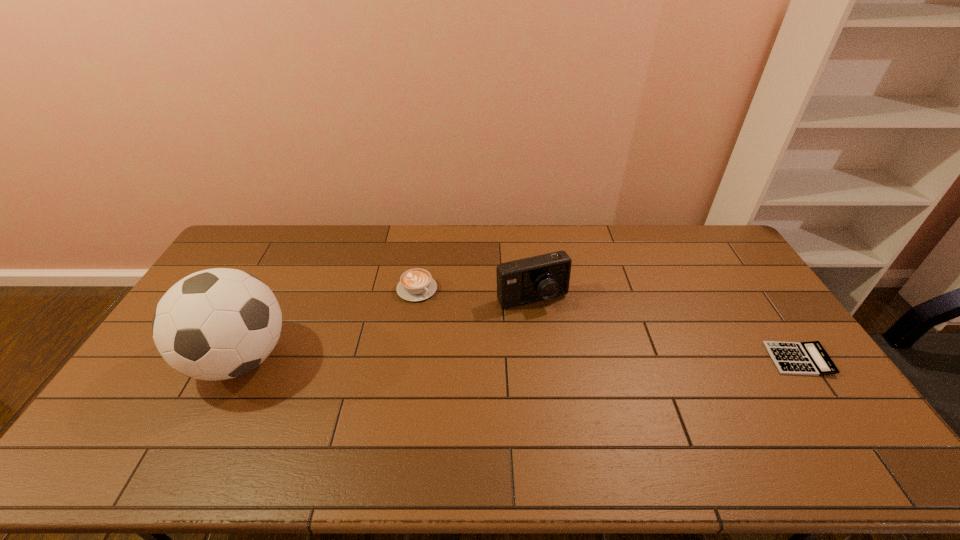
At what (x,y) coordinates should I click in order to perform the action: click on vacant space on the desktop that is between the tallest object and the rightmost object and is positioned on the side of the third object from right to left with the handle. Please return your answer as a coordinate pair (x, y). The height and width of the screenshot is (540, 960). Looking at the image, I should click on (494, 359).

Where is `vacant spot on the desktop that is between the tallest object and the calculator and is positioned on the front-facing side of the camera`? Image resolution: width=960 pixels, height=540 pixels. vacant spot on the desktop that is between the tallest object and the calculator and is positioned on the front-facing side of the camera is located at coordinates (564, 359).